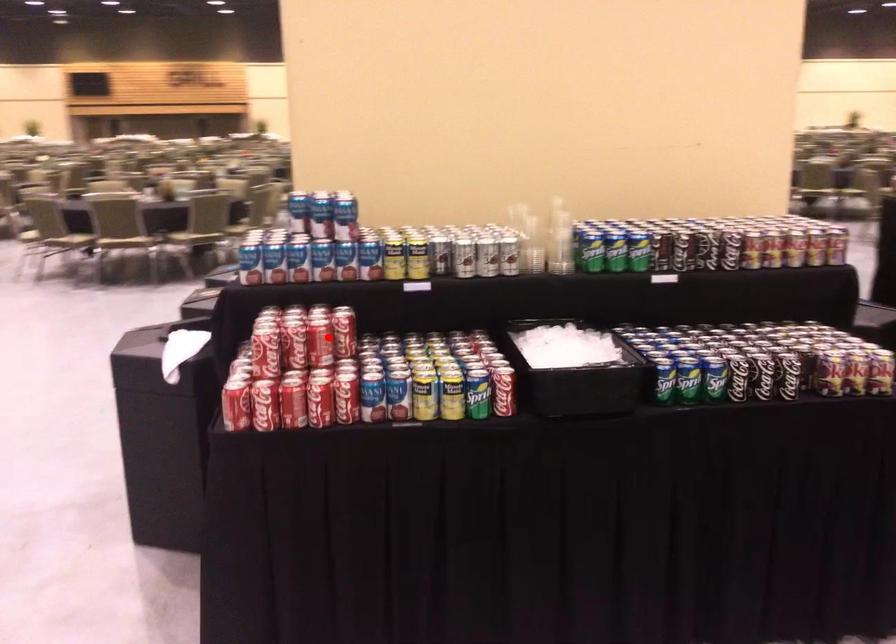
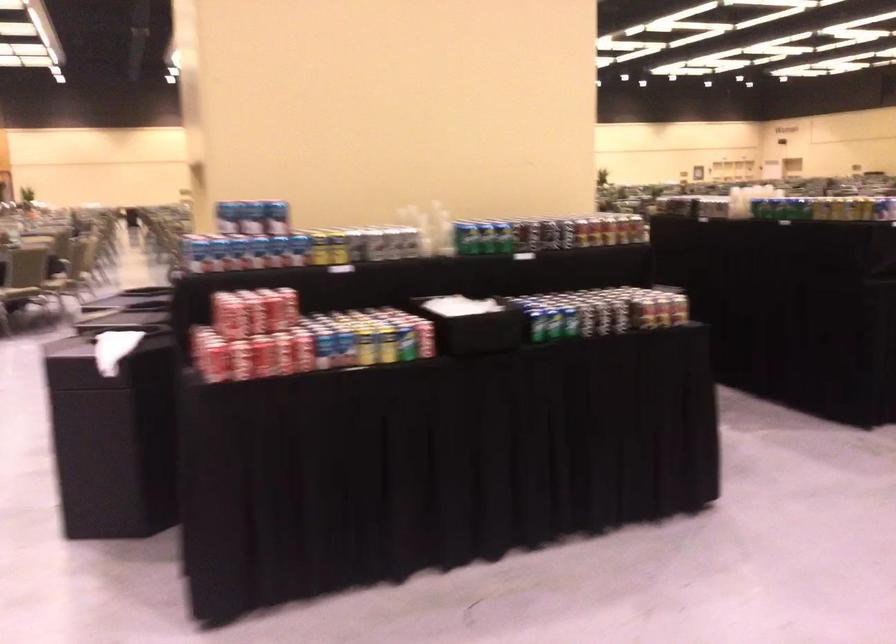
Locate, in the second image, the point that corresponds to the highlighted location in the first image.

(279, 307)